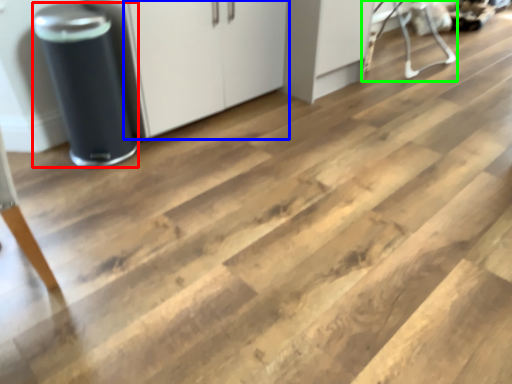
Question: Which is nearer to the appliance (highlighted by a red box)? cabinetry (highlighted by a blue box) or furniture (highlighted by a green box).

Choices:
 (A) cabinetry
 (B) furniture

Answer: (A)